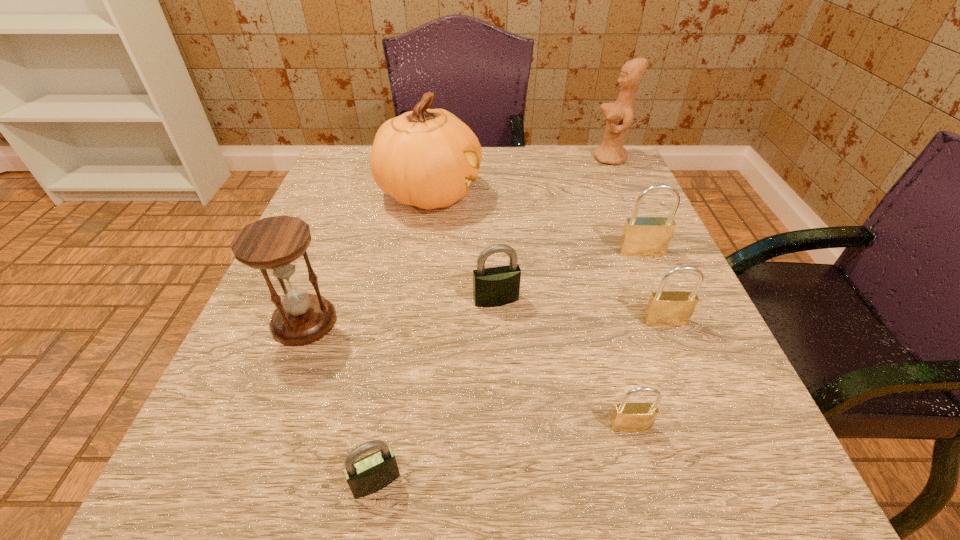
The height and width of the screenshot is (540, 960). Identify the location of free space located on the front-facing side of the third nearest padlock. (721, 461).

The height and width of the screenshot is (540, 960). I want to click on vacant space located on the left of the leftmost padlock, so click(x=221, y=482).

Image resolution: width=960 pixels, height=540 pixels. What are the coordinates of `vacant space situated on the front-facing side of the fourth farthest padlock` in the screenshot? It's located at (641, 470).

Find the location of a particular element. The width and height of the screenshot is (960, 540). figurine that is at the far edge is located at coordinates (618, 118).

This screenshot has height=540, width=960. I want to click on pumpkin positioned at the far edge, so [x=427, y=158].

Image resolution: width=960 pixels, height=540 pixels. I want to click on object that is at the near edge, so click(x=374, y=472).

What are the coordinates of `pumpkin that is at the left edge` in the screenshot? It's located at (427, 158).

You are a GUI agent. You are given a task and a screenshot of the screen. Output one action in this format:
    pyautogui.click(x=<x>, y=<y>)
    Task: Click on the hourglass located at the left edge
    The image size is (960, 540).
    Given the screenshot: What is the action you would take?
    pyautogui.click(x=272, y=244)

The width and height of the screenshot is (960, 540). Find the location of `figurine that is at the right edge`. figurine that is at the right edge is located at coordinates (618, 118).

Where is `object at the far left corner`? object at the far left corner is located at coordinates (427, 158).